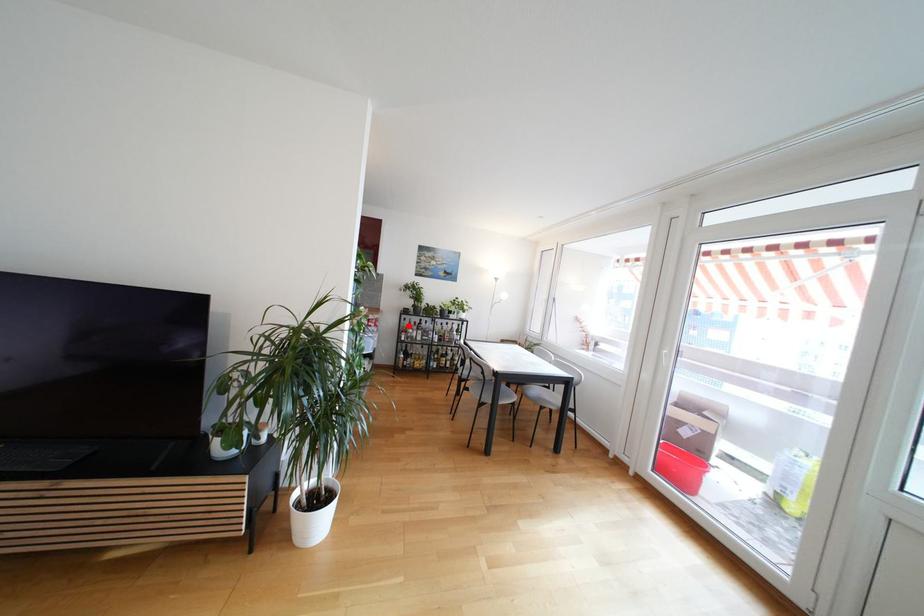
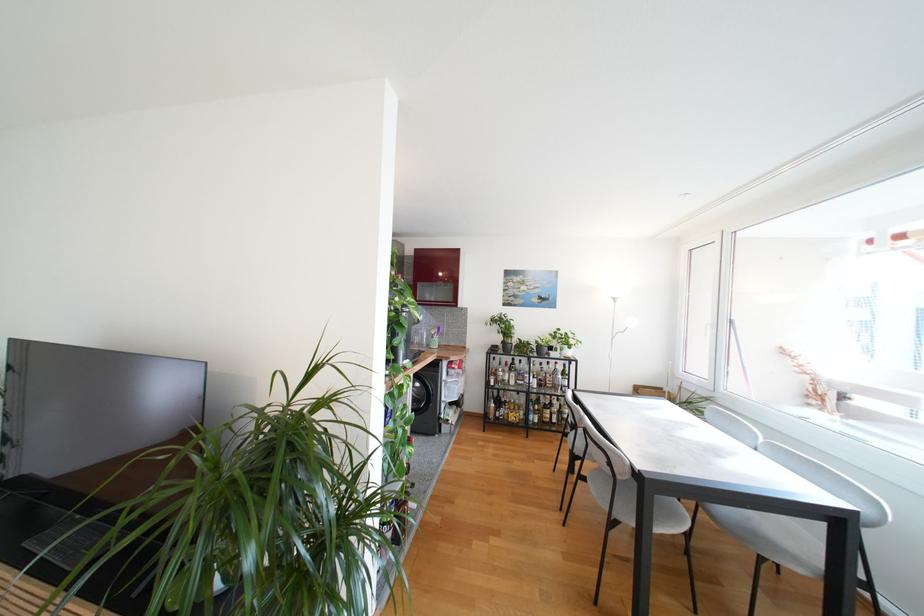
Locate, in the second image, the point that corresponds to the highlighted location in the first image.

(497, 366)